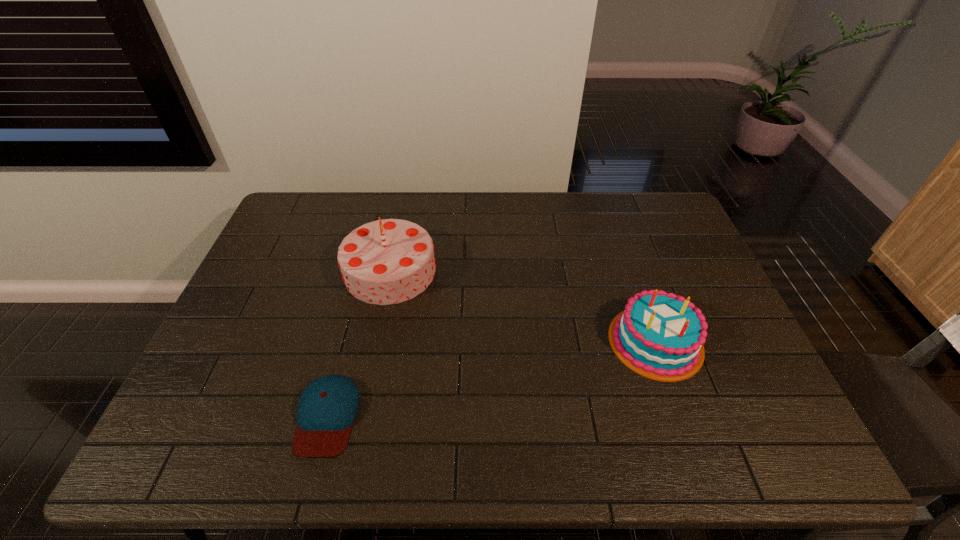
Find the location of `free location at the left edge of the desktop`. free location at the left edge of the desktop is located at coordinates (283, 287).

Image resolution: width=960 pixels, height=540 pixels. Find the location of `vacant region at the right edge of the desktop`. vacant region at the right edge of the desktop is located at coordinates (725, 424).

Identify the location of vacant space at the near left corner. (217, 454).

Locate an element on the screen. Image resolution: width=960 pixels, height=540 pixels. vacant space in between the second tallest object and the left birthday cake is located at coordinates (523, 306).

This screenshot has width=960, height=540. Find the location of `vacant space in between the shortest object and the taller birthday cake`. vacant space in between the shortest object and the taller birthday cake is located at coordinates (359, 343).

The width and height of the screenshot is (960, 540). Identify the location of vacant area that lies between the shorter birthday cake and the tallest object. (523, 306).

You are a GUI agent. You are given a task and a screenshot of the screen. Output one action in this format:
    pyautogui.click(x=<x>, y=<y>)
    Task: Click on the free space between the taller birthday cake and the right birthday cake
    The width and height of the screenshot is (960, 540).
    Given the screenshot: What is the action you would take?
    pyautogui.click(x=523, y=306)

In order to click on free spot between the second tallest object and the left birthday cake in this screenshot , I will do `click(523, 306)`.

Image resolution: width=960 pixels, height=540 pixels. Find the location of `vacant region between the left birthday cake and the baseball cap`. vacant region between the left birthday cake and the baseball cap is located at coordinates (359, 343).

The height and width of the screenshot is (540, 960). In order to click on free space that is in between the baseball cap and the second shortest object in this screenshot , I will do `click(492, 379)`.